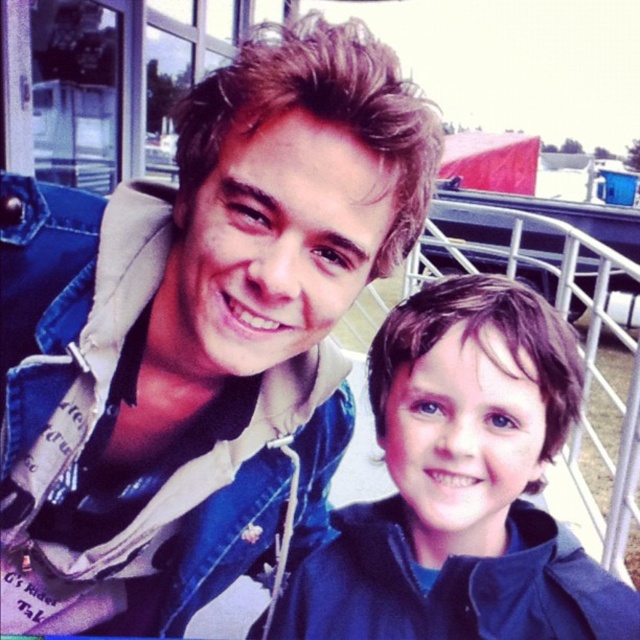
You are standing at the position of point (x=330, y=580) and want to move to the position of point (x=163, y=189). Based on the scene description, which direction should you face to walk towards the other point?

Point (x=163, y=189) is in front of point (x=330, y=580), so you should face forward to walk towards it.

You are standing at the origin point of the coordinate system in the image. The young man and the boy are in front of you. Where is the matte blue jacket at lower right located in terms of coordinates?

The matte blue jacket at lower right is located at coordinates point (x=461, y=484).